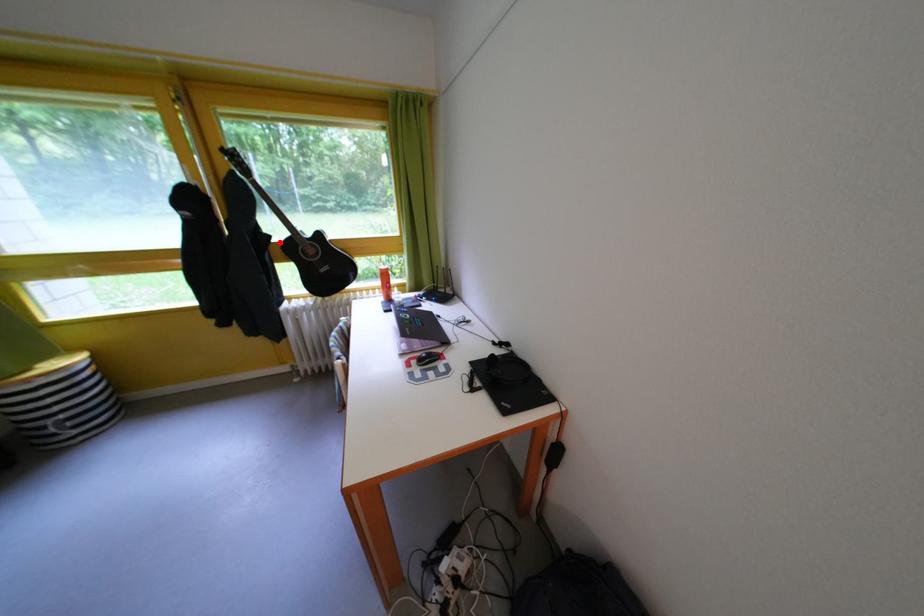
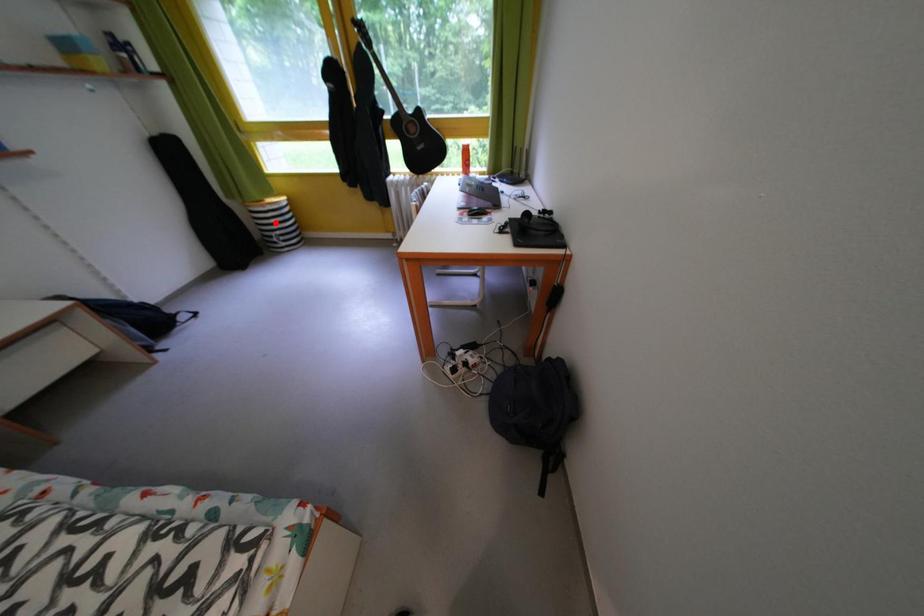
I am providing you with two images of the same scene from different viewpoints. A red point is marked on the first image and another point is marked on the second image. Are the points marked in image1 and image2 representing the same 3D position?

No